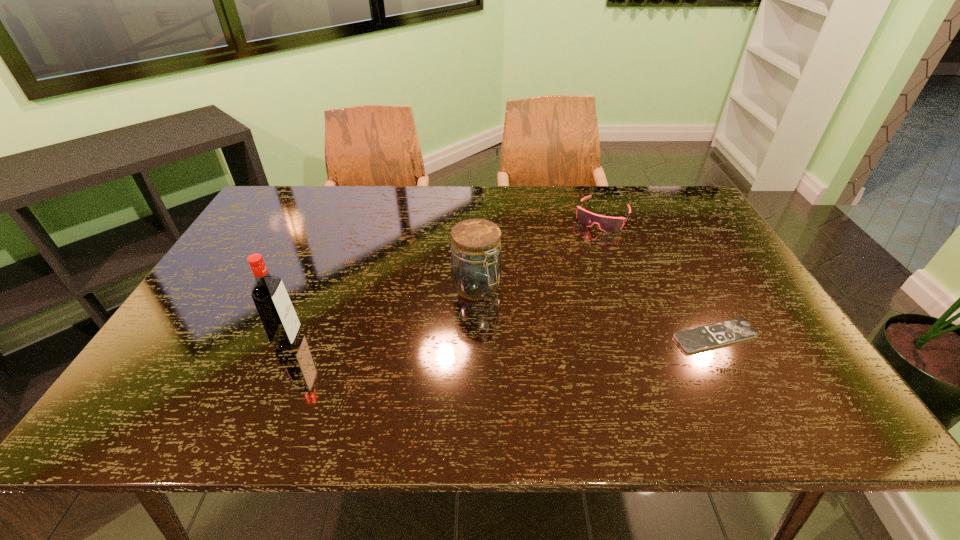
Image resolution: width=960 pixels, height=540 pixels. Find the location of `vodka`. vodka is located at coordinates (281, 324).

At what (x,y) coordinates should I click in order to perform the action: click on the tallest object. Please return your answer as a coordinate pair (x, y). This screenshot has width=960, height=540. Looking at the image, I should click on (281, 324).

You are a GUI agent. You are given a task and a screenshot of the screen. Output one action in this format:
    pyautogui.click(x=<x>, y=<y>)
    Task: Click on the remote control
    
    Given the screenshot: What is the action you would take?
    (x=700, y=338)

Find the location of a particular element. the third nearest object is located at coordinates (476, 269).

Where is `jar`? The image size is (960, 540). jar is located at coordinates (476, 269).

Locate an element on the screen. The height and width of the screenshot is (540, 960). the second shortest object is located at coordinates (607, 224).

Locate an element on the screen. the farthest object is located at coordinates (607, 224).

Where is `vacant space situated 0.050m on the front and back of the leftmost object`? This screenshot has height=540, width=960. vacant space situated 0.050m on the front and back of the leftmost object is located at coordinates (321, 339).

You are a GUI agent. You are given a task and a screenshot of the screen. Output one action in this format:
    pyautogui.click(x=<x>, y=<y>)
    Task: Click on the free space located on the back of the shortest object
    The width and height of the screenshot is (960, 540).
    Given the screenshot: What is the action you would take?
    pyautogui.click(x=670, y=251)

Identify the location of free space located 0.250m on the lid of the third shortest object. (548, 371).